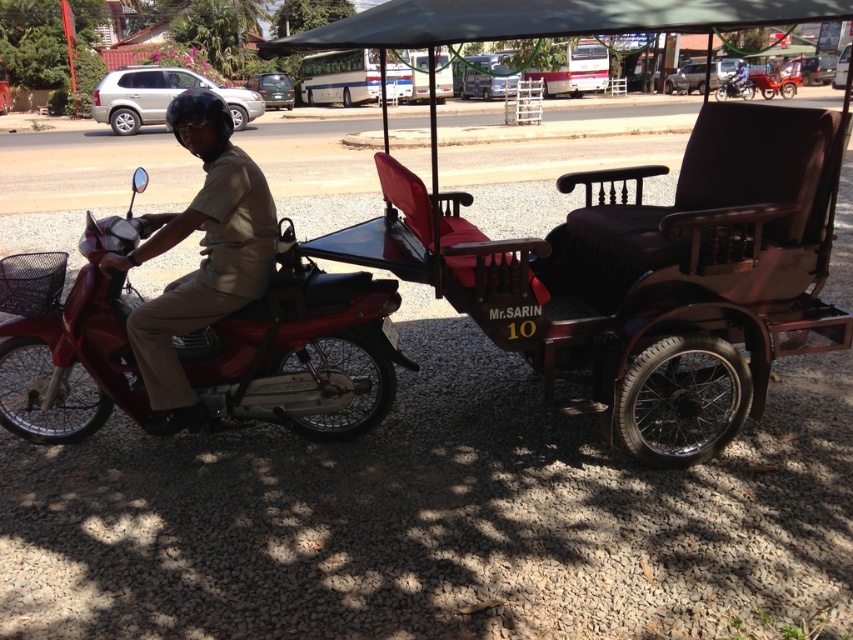
Does shiny red motorcycle at left appear on the right side of matte khaki uniform at left?

No, shiny red motorcycle at left is not to the right of matte khaki uniform at left.

Who is lower down, shiny red motorcycle at left or matte khaki uniform at left?

Positioned lower is shiny red motorcycle at left.

The image size is (853, 640). In order to click on shiny red motorcycle at left in this screenshot , I will do `click(299, 349)`.

Who is positioned more to the left, shiny red motorcycle at left or metallic silver motorcycle at center?

shiny red motorcycle at left

Can you confirm if shiny red motorcycle at left is thinner than metallic silver motorcycle at center?

Correct, shiny red motorcycle at left's width is less than metallic silver motorcycle at center's.

Between point (73, 292) and point (729, 90), which one is positioned in front?

Positioned in front is point (73, 292).

Where is `shiny red motorcycle at left`? shiny red motorcycle at left is located at coordinates (299, 349).

Can you confirm if matte khaki uniform at left is wider than metallic silver motorcycle at center?

No, matte khaki uniform at left is not wider than metallic silver motorcycle at center.

Is point (189, 317) positioned after point (740, 92)?

No, it is in front of (740, 92).

Where is `matte khaki uniform at left`? The image size is (853, 640). matte khaki uniform at left is located at coordinates 200,253.